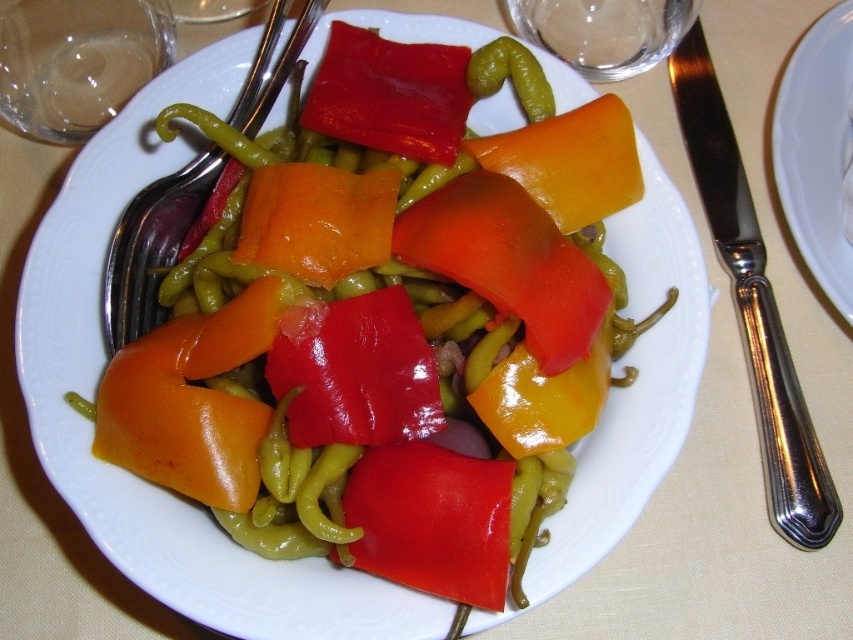
You are looking at the plate of vegetables. There are two points marked on the plate, one at coordinates point (233, 268) and the other at point (608, 180). Which point is closer to you?

Point (233, 268) is closer to the camera than point (608, 180).

From the picture: You are a chef preparing a dish and need to arrange vegetables on a plate. You have a shiny plastic peppers at center and a yellow matte carrot at center. Which vegetable should you place in a position where height matters to ensure visibility?

The shiny plastic peppers at center should be placed where height matters because it has a greater height compared to the yellow matte carrot at center, making it more visible.